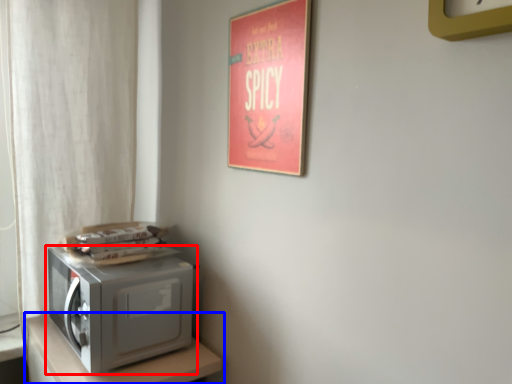
Question: Among these objects, which one is farthest to the camera, home appliance (highlighted by a red box) or furniture (highlighted by a blue box)?

Choices:
 (A) home appliance
 (B) furniture

Answer: (A)